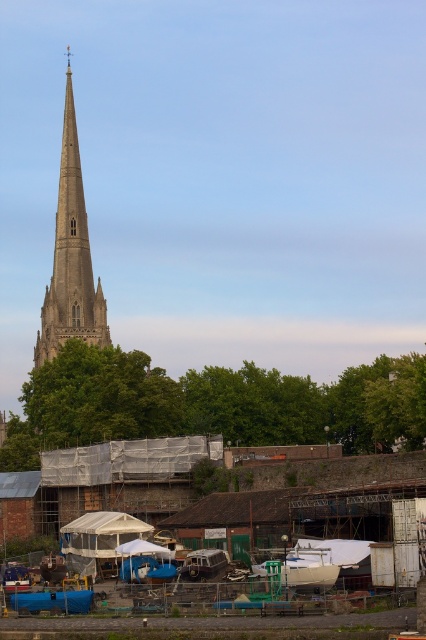
Question: Is smooth stone spire at left to the right of white matte boat at center from the viewer's perspective?

Choices:
 (A) yes
 (B) no

Answer: (B)

Question: From the image, what is the correct spatial relationship of smooth stone spire at left in relation to white matte boat at center?

Choices:
 (A) left
 (B) right

Answer: (A)

Question: Which of the following is the farthest from the observer?

Choices:
 (A) (296, 552)
 (B) (75, 323)

Answer: (B)

Question: Is smooth stone spire at left further to the viewer compared to white matte boat at center?

Choices:
 (A) yes
 (B) no

Answer: (A)